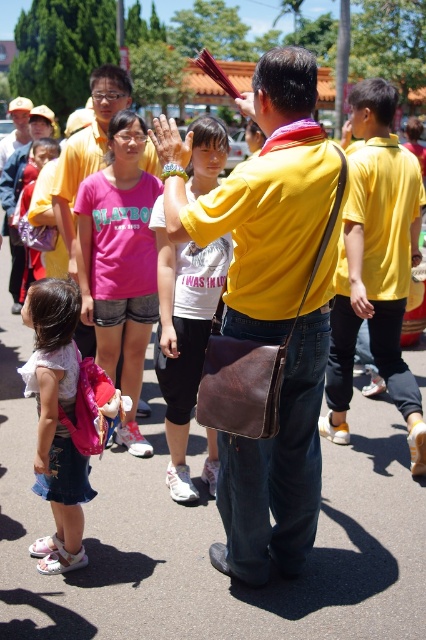
Question: Among these points, which one is farthest from the camera?

Choices:
 (A) (293, 248)
 (B) (109, 253)
 (C) (345, 237)
 (D) (178, 330)

Answer: (B)

Question: Is matte yellow shirt at center thinner than matte pink backpack at lower left?

Choices:
 (A) no
 (B) yes

Answer: (A)

Question: Is matte yellow shirt at center wider than yellow matte shirt at center?

Choices:
 (A) yes
 (B) no

Answer: (A)

Question: Does yellow matte shirt at center appear on the left side of pink cotton t-shirt at center?

Choices:
 (A) no
 (B) yes

Answer: (A)

Question: Which object is closer to the camera taking this photo?

Choices:
 (A) matte yellow shirt at center
 (B) white cotton t-shirt at center
 (C) matte pink backpack at lower left

Answer: (A)

Question: Which point is closer to the camera?

Choices:
 (A) (77, 296)
 (B) (388, 368)
 (C) (192, 193)
 (D) (143, 236)

Answer: (A)